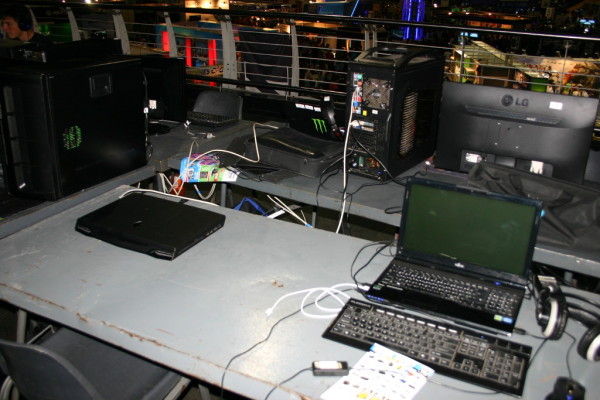
This screenshot has width=600, height=400. Find the location of `table`. table is located at coordinates (172, 290).